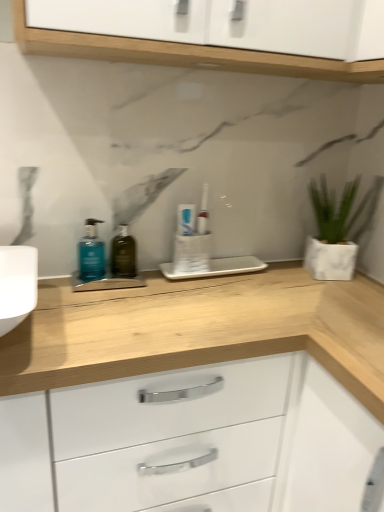
Question: Is teal matte pump bottle at left wider than white matte pot at right?

Choices:
 (A) yes
 (B) no

Answer: (B)

Question: Is teal matte pump bottle at left taller than white matte pot at right?

Choices:
 (A) no
 (B) yes

Answer: (A)

Question: Does teal matte pump bottle at left have a lesser height compared to white matte pot at right?

Choices:
 (A) no
 (B) yes

Answer: (B)

Question: From the image's perspective, is teal matte pump bottle at left below white matte pot at right?

Choices:
 (A) no
 (B) yes

Answer: (B)

Question: Does teal matte pump bottle at left have a larger size compared to white matte pot at right?

Choices:
 (A) yes
 (B) no

Answer: (B)

Question: Considering the positions of point (178, 219) and point (349, 209), is point (178, 219) closer or farther from the camera than point (349, 209)?

Choices:
 (A) closer
 (B) farther

Answer: (A)

Question: Relative to white matte pot at right, is white glossy toothpaste at center in front or behind?

Choices:
 (A) front
 (B) behind

Answer: (B)

Question: Considering the positions of white glossy toothpaste at center and white matte pot at right in the image, is white glossy toothpaste at center bigger or smaller than white matte pot at right?

Choices:
 (A) small
 (B) big

Answer: (A)

Question: In the image, is white glossy toothpaste at center on the left side or the right side of white matte pot at right?

Choices:
 (A) left
 (B) right

Answer: (A)

Question: From a real-world perspective, is white matte pot at right above or below green glass bottle at center?

Choices:
 (A) above
 (B) below

Answer: (A)

Question: In terms of height, does white matte pot at right look taller or shorter compared to green glass bottle at center?

Choices:
 (A) short
 (B) tall

Answer: (B)

Question: From the image's perspective, is white matte pot at right above or below green glass bottle at center?

Choices:
 (A) above
 (B) below

Answer: (A)

Question: Is white matte pot at right wider or thinner than green glass bottle at center?

Choices:
 (A) wide
 (B) thin

Answer: (A)

Question: From the image's perspective, is white matte pot at right located above or below teal matte pump bottle at left?

Choices:
 (A) below
 (B) above

Answer: (B)

Question: From a real-world perspective, is white matte pot at right above or below teal matte pump bottle at left?

Choices:
 (A) above
 (B) below

Answer: (A)